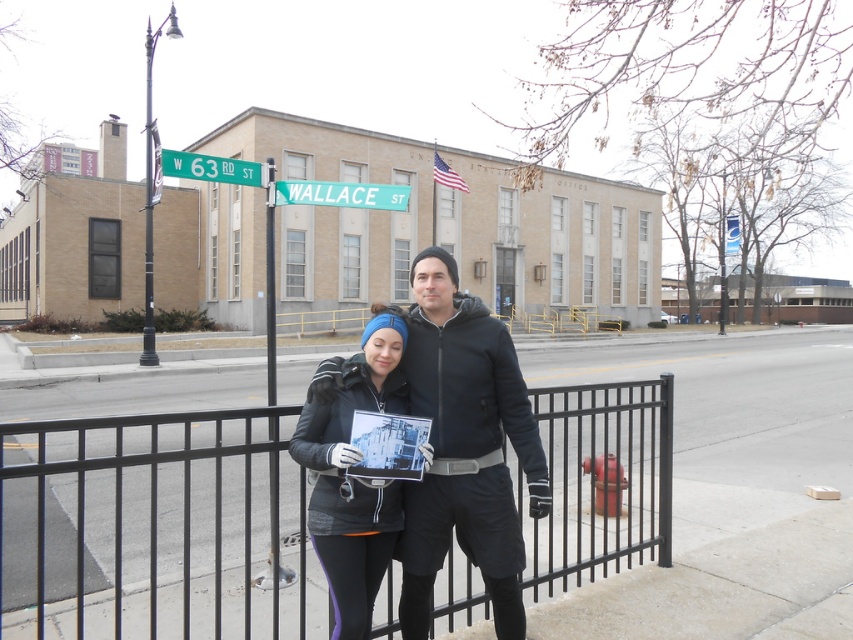
Question: Can you confirm if teal plastic street sign at upper center is positioned above black metal pole at upper left?

Choices:
 (A) yes
 (B) no

Answer: (B)

Question: Estimate the real-world distances between objects in this image. Which object is closer to the brushed metal pole at center?

Choices:
 (A) black fleece jacket at center
 (B) black metal fence at center

Answer: (B)

Question: Is matte black jacket at center positioned before brushed metal pole at center?

Choices:
 (A) yes
 (B) no

Answer: (A)

Question: Estimate the real-world distances between objects in this image. Which object is farther from the green metallic street sign at upper left?

Choices:
 (A) brushed metal pole at center
 (B) matte black jacket at center

Answer: (B)

Question: Considering the relative positions of black metal pole at upper left and green metallic street sign at upper left in the image provided, where is black metal pole at upper left located with respect to green metallic street sign at upper left?

Choices:
 (A) above
 (B) below

Answer: (A)

Question: Which point is farther to the camera?

Choices:
 (A) (265, 364)
 (B) (149, 230)

Answer: (B)